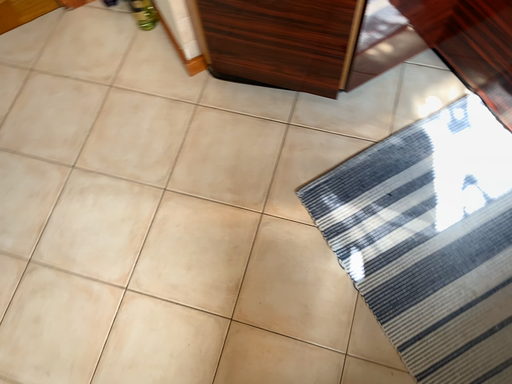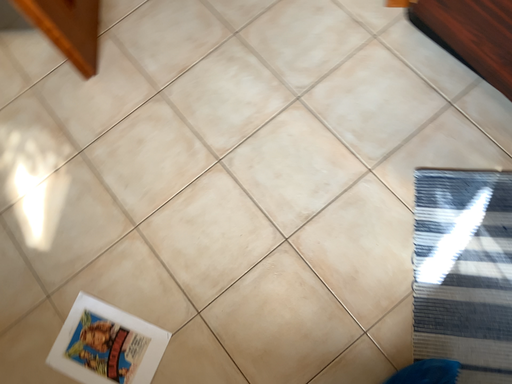
Question: Which way did the camera rotate in the video?

Choices:
 (A) rotated left
 (B) rotated right

Answer: (A)